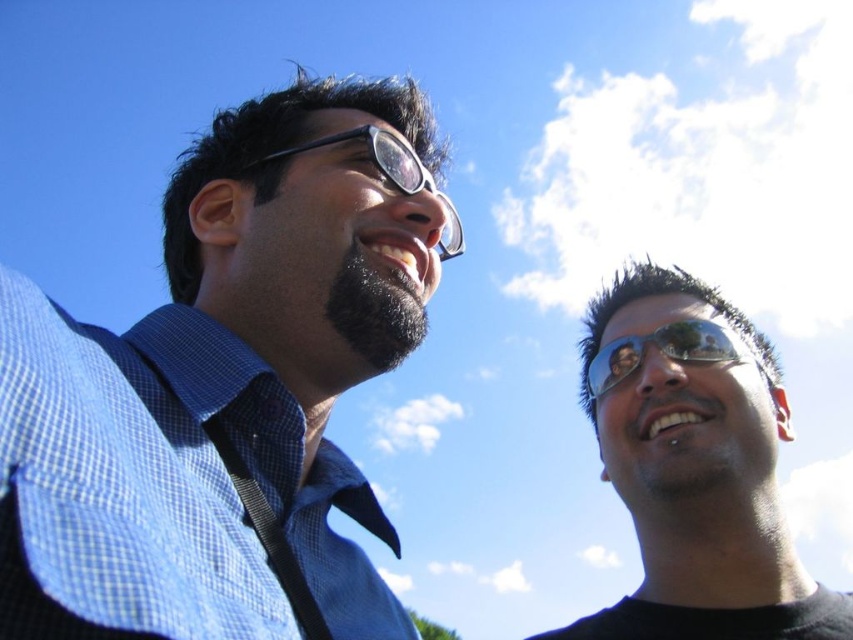
Question: Which point appears farthest from the camera in this image?

Choices:
 (A) (170, 285)
 (B) (581, 376)
 (C) (759, 371)

Answer: (B)

Question: Observing the image, what is the correct spatial positioning of blue checkered shirt at left in reference to sunglasses at right?

Choices:
 (A) below
 (B) above

Answer: (B)

Question: Does blue checkered shirt at left have a lesser width compared to sunglasses at center?

Choices:
 (A) yes
 (B) no

Answer: (A)

Question: Which of the following is the farthest from the observer?

Choices:
 (A) (428, 186)
 (B) (675, 332)

Answer: (B)

Question: Among these objects, which one is nearest to the camera?

Choices:
 (A) blue checkered shirt at left
 (B) black plastic goggles at upper center
 (C) sunglasses at right

Answer: (A)

Question: Can you confirm if blue checkered shirt at left is positioned to the right of black plastic goggles at upper center?

Choices:
 (A) yes
 (B) no

Answer: (B)